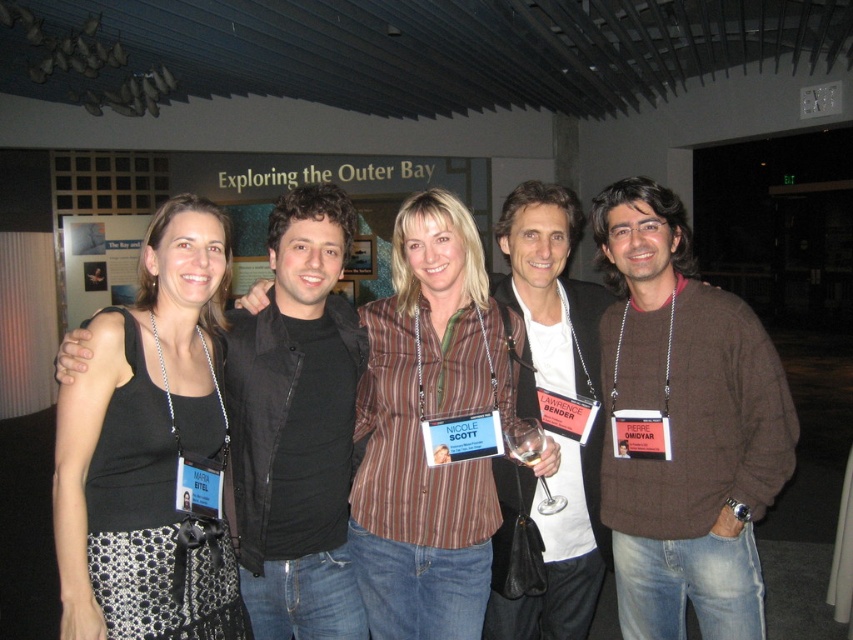
You are standing in the conference room and want to find the person wearing the brown striped shirt at center. Which direction should you look relative to the person wearing the brown sweater at right?

The brown sweater at right is to the right of the brown striped shirt at center, so you should look to the left of the brown sweater at right to find the brown striped shirt at center.

You are a photographer standing at the center of the room. You want to ensure that both the brown sweater at right and the black textured tank top at left are in focus. Given that your camera can only focus on objects within a 4 feet range from the focal point, where should you set your focus to capture both clearly?

Set the focal point between the brown sweater at right and the black textured tank top at left. Since the distance between them is 3.99 feet, placing the focus midway ensures both are within the 4 feet range required for clear focus.

How far apart are the two people wearing the black textured tank top at left and the other object?

The two people wearing the black textured tank top at left are 5.72 feet apart.